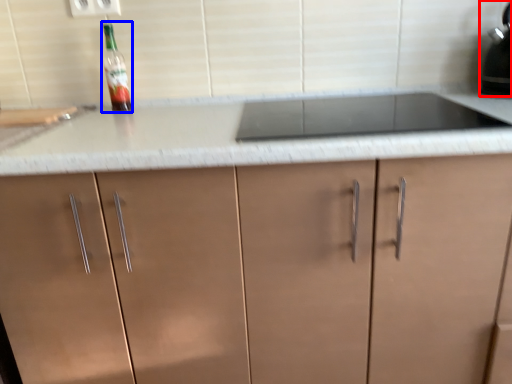
Question: Which object appears farthest to the camera in this image, kitchen appliance (highlighted by a red box) or bottle (highlighted by a blue box)?

Choices:
 (A) kitchen appliance
 (B) bottle

Answer: (B)